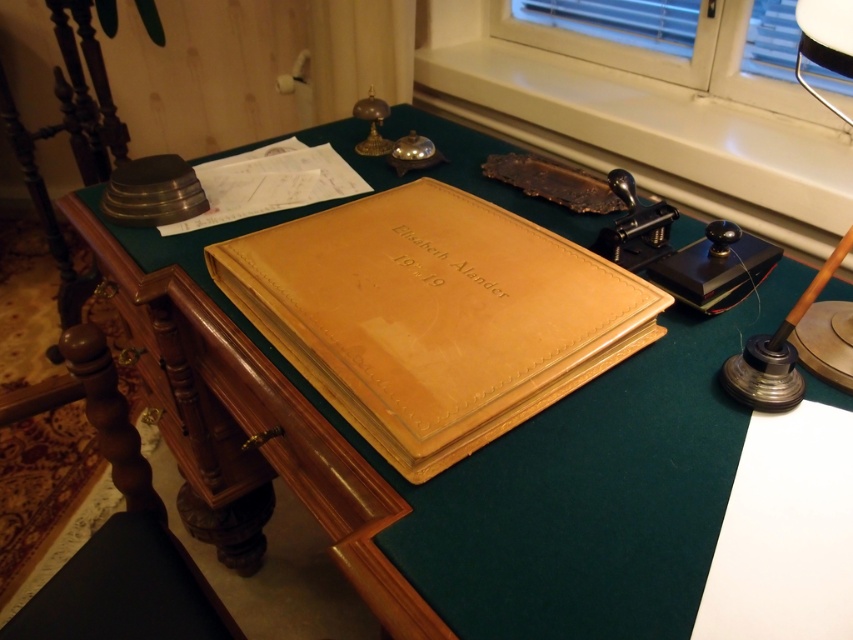
You are organizing a historical exhibition and need to place the matte leather book at center and the brown wood chair at lower left in a display case. The display case has a height limit of 30 cm. Can both items fit vertically without exceeding the height limit?

The matte leather book at center is shorter than the brown wood chair at lower left. Since the display case has a 30 cm height limit, we need to know the exact height of the taller item. However, since the brown wood chair at lower left is taller than the book, if the chair is under 30 cm, both can fit. But without specific measurements, we can only confirm that the chair is taller than the book. Please check the chair height against the limit.

You are organizing items on the vintage desk and need to place a new item between the matte leather book at center and the white plastic window at upper right. Which object should you place closer to the edge of the desk to ensure the new item fits without overlapping?

Since the matte leather book at center is smaller than the white plastic window at upper right, you should place the smaller matte leather book at center closer to the edge to accommodate the larger window.